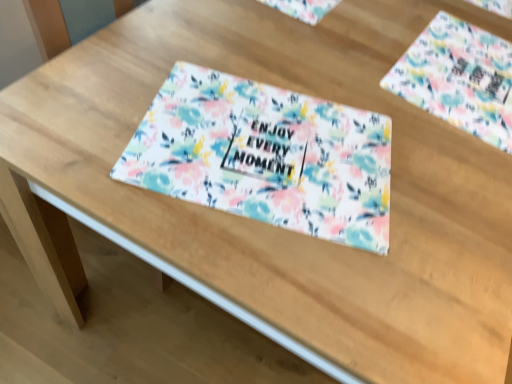
Where is `free spot in front of floral fabric placemat at center`? The width and height of the screenshot is (512, 384). free spot in front of floral fabric placemat at center is located at coordinates 273,269.